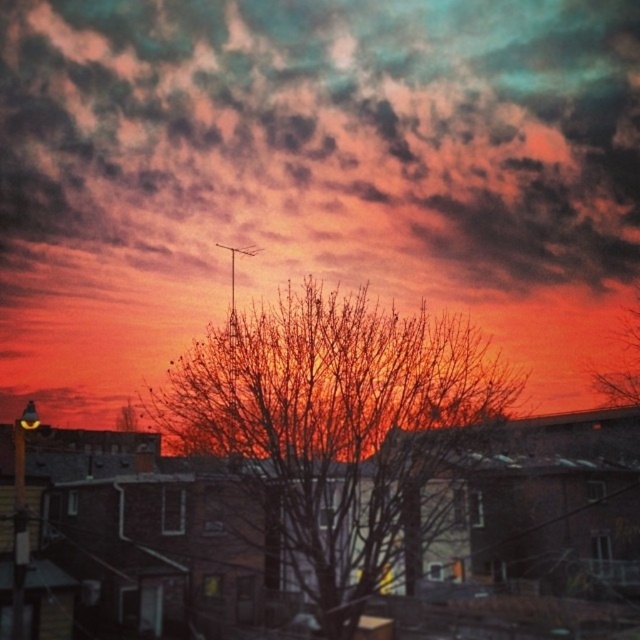
Is point (243, 13) positioned before point (416, 348)?

No.

The image size is (640, 640). What do you see at coordinates (324, 134) in the screenshot?
I see `cloudy sky at upper center` at bounding box center [324, 134].

Image resolution: width=640 pixels, height=640 pixels. In order to click on cloudy sky at upper center in this screenshot , I will do `click(324, 134)`.

Where is `cloudy sky at upper center`? cloudy sky at upper center is located at coordinates pyautogui.click(x=324, y=134).